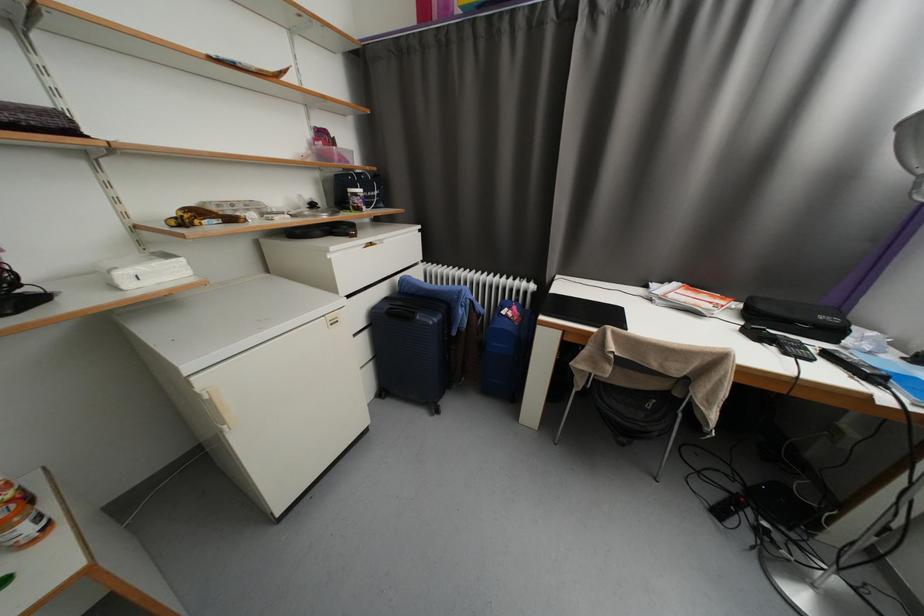
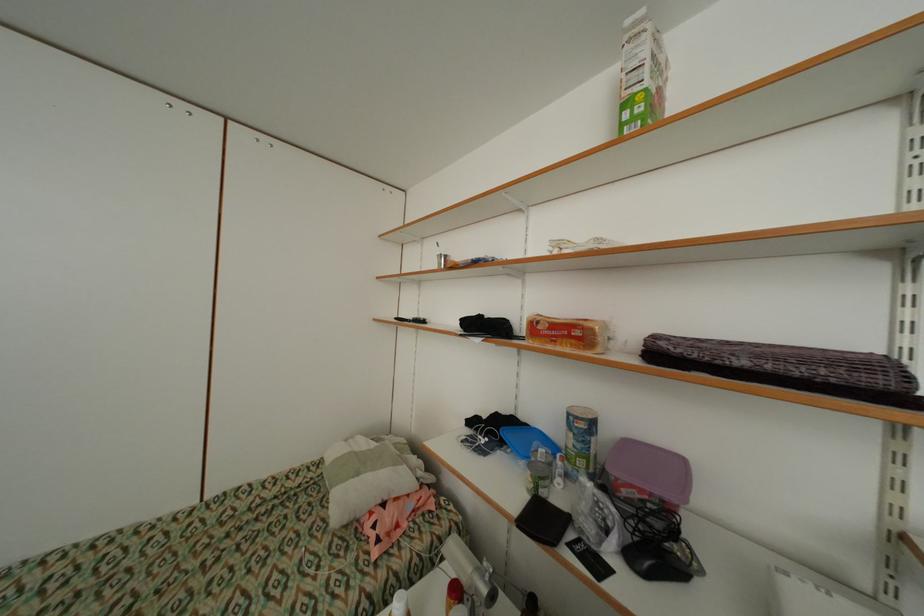
Question: The images are taken continuously from a first-person perspective. In which direction is your viewpoint rotating?

Choices:
 (A) Left
 (B) Right
 (C) Up
 (D) Down

Answer: (A)